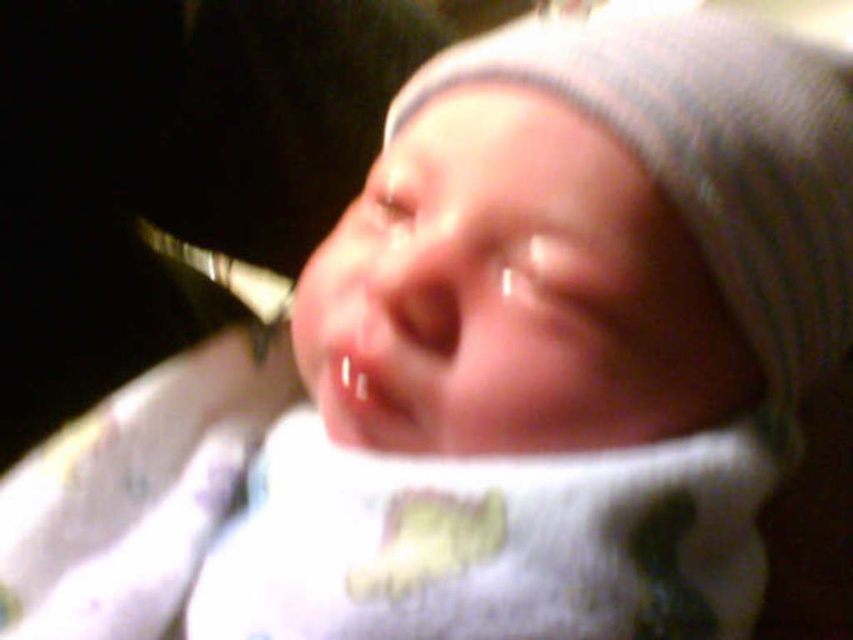
How much distance is there between white knit hat at upper center and smooth flesh mouth at center?

A distance of 16.79 centimeters exists between white knit hat at upper center and smooth flesh mouth at center.

Is point (740, 208) closer to camera compared to point (376, 419)?

Yes.

Who is more forward, (593, 84) or (386, 420)?

Point (593, 84) is more forward.

This screenshot has height=640, width=853. I want to click on white knit hat at upper center, so click(714, 161).